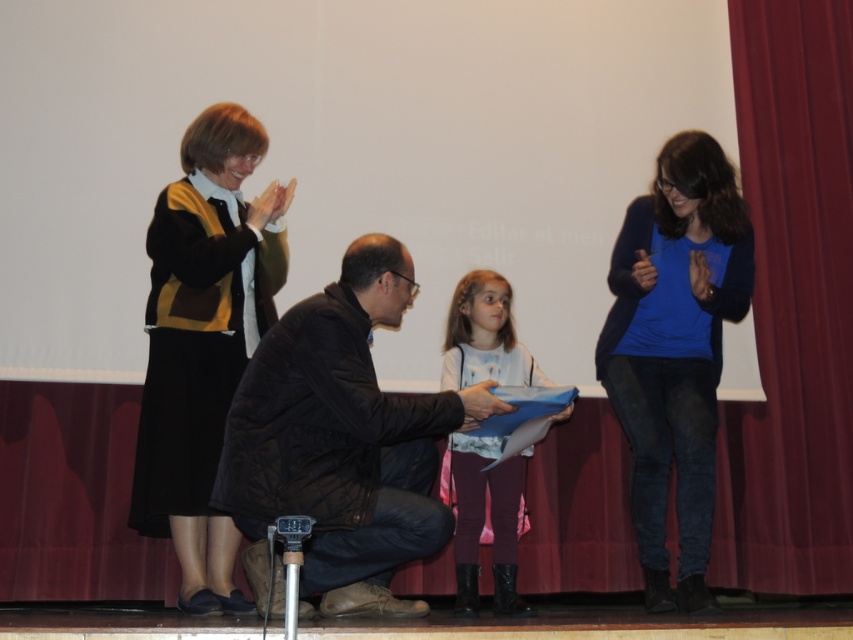
Question: Can you confirm if blue cotton shirt at right is smaller than pink fabric dress at center?

Choices:
 (A) no
 (B) yes

Answer: (A)

Question: Does dark brown leather jacket at center come in front of matte black sweater at left?

Choices:
 (A) yes
 (B) no

Answer: (A)

Question: Which is farther from the dark brown leather jacket at center?

Choices:
 (A) blue cotton shirt at right
 (B) matte black sweater at left
 (C) pink fabric dress at center

Answer: (A)

Question: Can you confirm if dark brown leather jacket at center is positioned to the left of matte black sweater at left?

Choices:
 (A) no
 (B) yes

Answer: (A)

Question: Which object appears farthest from the camera in this image?

Choices:
 (A) blue cotton shirt at right
 (B) pink fabric dress at center
 (C) matte black sweater at left
 (D) dark brown leather jacket at center

Answer: (B)

Question: Among these objects, which one is farthest from the camera?

Choices:
 (A) blue cotton shirt at right
 (B) matte black sweater at left

Answer: (B)